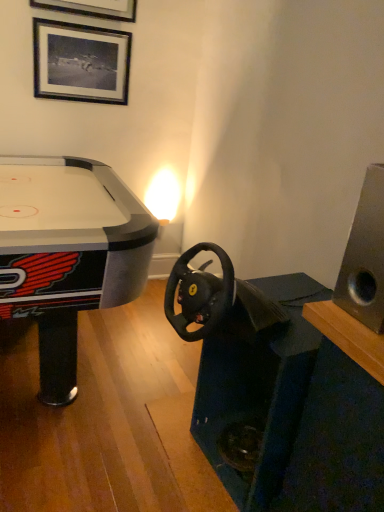
Question: From a real-world perspective, is silver metallic speaker at right positioned over black matte picture frame at upper left based on gravity?

Choices:
 (A) no
 (B) yes

Answer: (A)

Question: From the image's perspective, would you say silver metallic speaker at right is positioned over black matte picture frame at upper left?

Choices:
 (A) yes
 (B) no

Answer: (B)

Question: Is black matte picture frame at upper left at the back of silver metallic speaker at right?

Choices:
 (A) no
 (B) yes

Answer: (A)

Question: Can you confirm if silver metallic speaker at right is positioned to the right of black matte picture frame at upper left?

Choices:
 (A) yes
 (B) no

Answer: (A)

Question: Could you tell me if silver metallic speaker at right is facing black matte picture frame at upper left?

Choices:
 (A) yes
 (B) no

Answer: (B)

Question: Can you confirm if silver metallic speaker at right is shorter than black matte picture frame at upper left?

Choices:
 (A) yes
 (B) no

Answer: (B)

Question: Is black matte picture frame at upper left further to the viewer compared to silver metallic speaker at right?

Choices:
 (A) no
 (B) yes

Answer: (B)

Question: Does black matte picture frame at upper left have a smaller size compared to silver metallic speaker at right?

Choices:
 (A) no
 (B) yes

Answer: (B)

Question: Is black matte picture frame at upper left touching silver metallic speaker at right?

Choices:
 (A) no
 (B) yes

Answer: (A)

Question: From a real-world perspective, is black matte picture frame at upper left located higher than silver metallic speaker at right?

Choices:
 (A) yes
 (B) no

Answer: (A)

Question: Does black matte picture frame at upper left have a greater width compared to silver metallic speaker at right?

Choices:
 (A) no
 (B) yes

Answer: (A)

Question: Considering the relative sizes of black matte picture frame at upper left and silver metallic speaker at right in the image provided, is black matte picture frame at upper left taller than silver metallic speaker at right?

Choices:
 (A) no
 (B) yes

Answer: (A)

Question: In the image, is black matte picture frame at upper left on the left side or the right side of silver metallic speaker at right?

Choices:
 (A) right
 (B) left

Answer: (B)